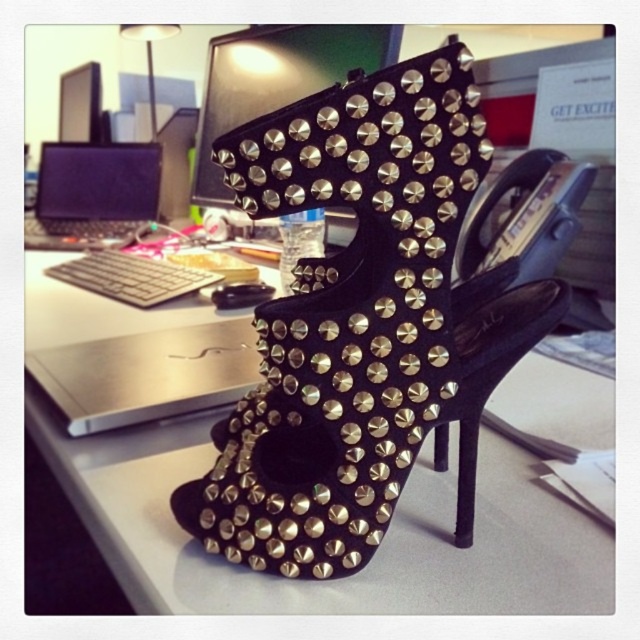
You are an office worker who just found a point marked at coordinates (276, 80) on the desk. You need to place a small sticker exactly at that point. Which object on the desk should you look for to locate this point?

The point (276, 80) is on the metallic studded shoe at upper center, so you should look for the metallic studded shoe at upper center to place the sticker there.

You are an office worker who wants to place both the black suede studded sandal at center and the black matte laptop at left on a shelf that can only hold items with a combined width of 50 cm. If the sandal is narrower than the laptop, can both items fit on the shelf together?

The black suede studded sandal at center has a lesser width compared to black matte laptop at left. Since the sandal is narrower, their combined width would depend on their individual measurements. However, without knowing the exact widths, it is impossible to determine if they fit within the 50 cm limit.

Consider the image. You are an office assistant who needs to place a new item on the desk. You have a metallic studded shoe at upper center and a black matte laptop at left. Which object is wider so that it can occupy more space on the desk?

The metallic studded shoe at upper center is wider than the black matte laptop at left, so it occupies more space on the desk.